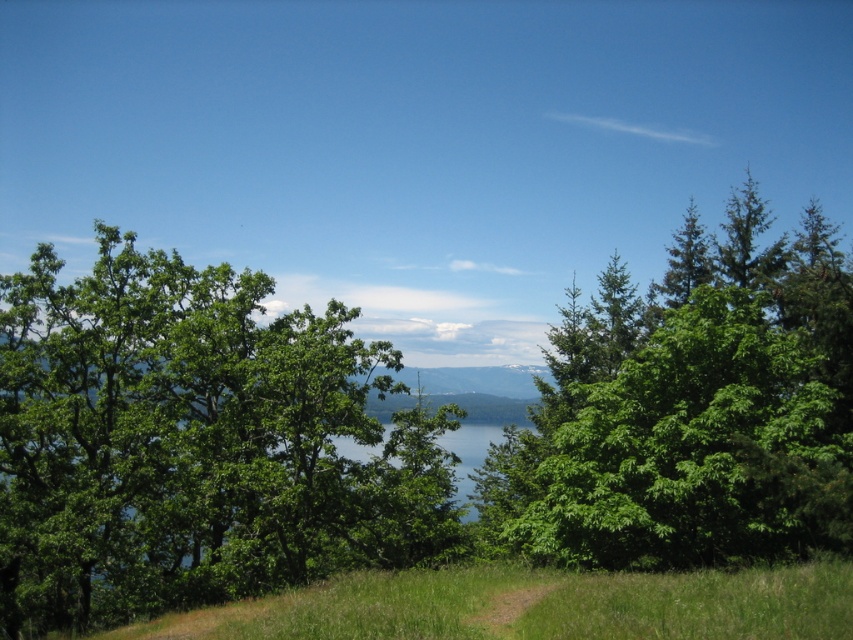
You are planning to plant a new tree in your backyard. You have two options based on the image you see. The first option is the green leafy tree at center, and the second is the green leafy tree at right. If you want a smaller tree for limited space, which one should you choose?

The green leafy tree at center has a smaller size compared to the green leafy tree at right, so you should choose the green leafy tree at center for limited space.

Consider the image. You are an explorer trying to determine which tree to climb for a better view. The green leafy tree at center and the green leafy tree at right are both in your path. Based on their sizes, which one would likely provide a wider platform for climbing?

The green leafy tree at right has a greater width than the green leafy tree at center, so it would likely provide a wider platform for climbing.